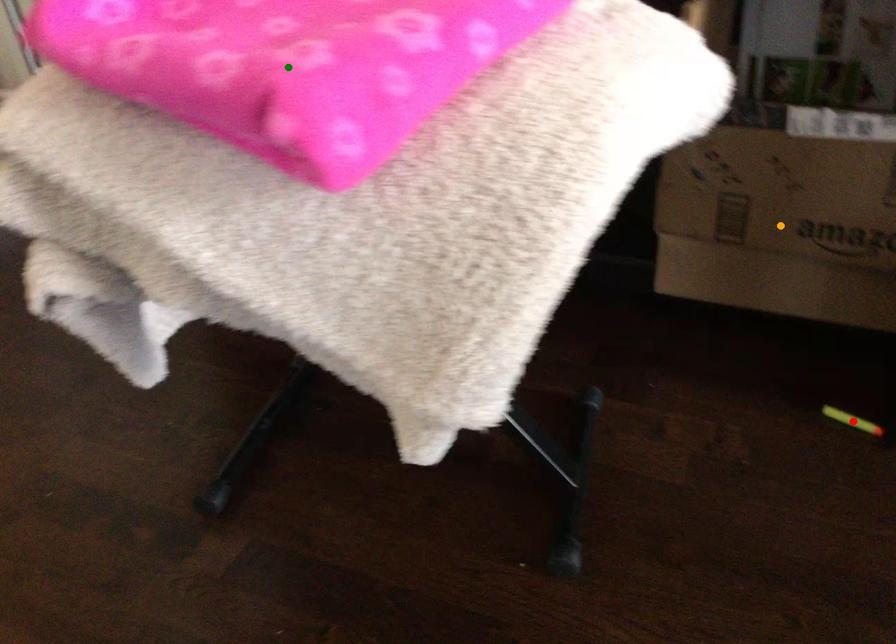
Order these from nearest to farthest:
green point | orange point | red point

green point, red point, orange point